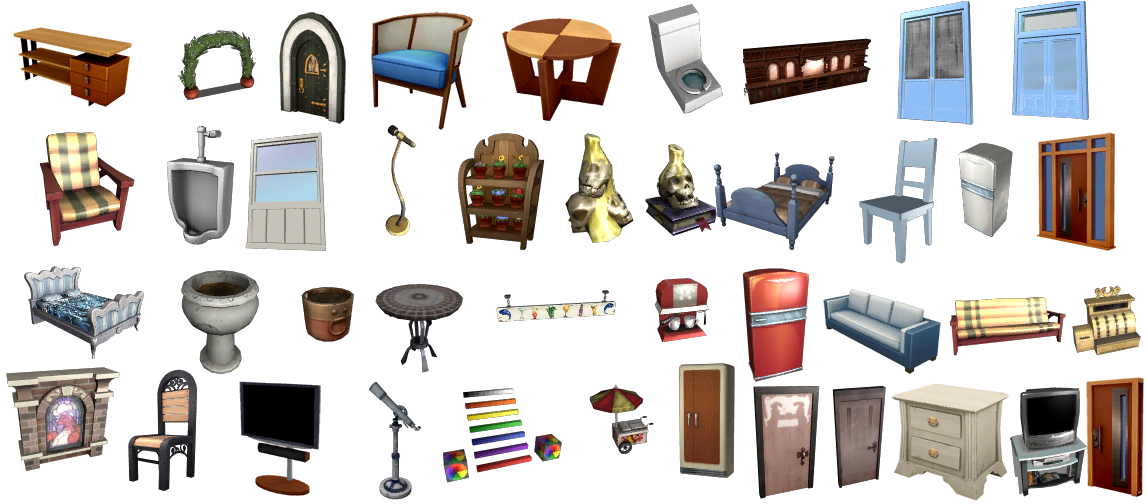
The width and height of the screenshot is (1147, 504). Identify the location of items you can sit on. (440, 39), (880, 210), (763, 211), (78, 202), (68, 313), (857, 315), (1007, 323), (151, 437), (696, 86).